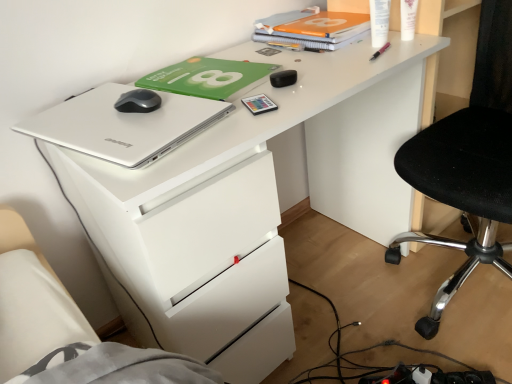
I want to click on free location to the right of green matte paperback book at upper center, so click(x=308, y=67).